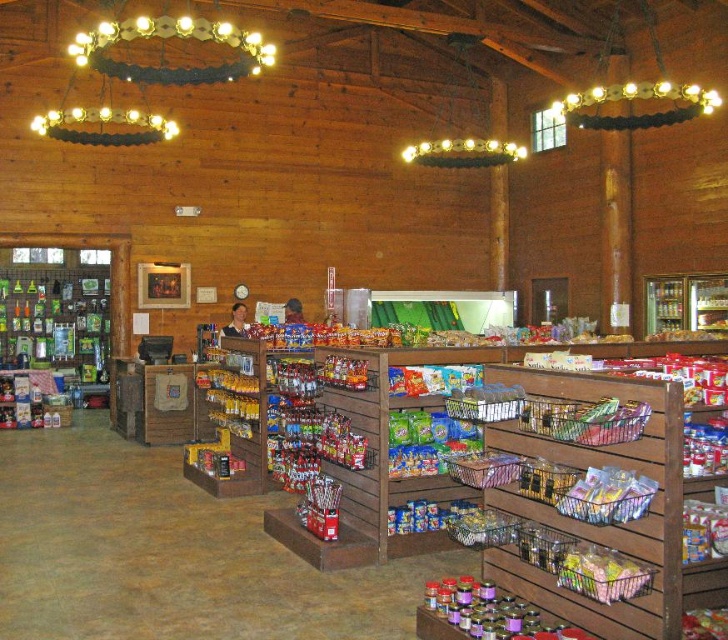
Question: Is gold metallic chandelier at upper center further to camera compared to shiny metallic can at lower right?

Choices:
 (A) no
 (B) yes

Answer: (B)

Question: Is gold metallic chandelier at upper center further to the viewer compared to metallic wire basket at center?

Choices:
 (A) no
 (B) yes

Answer: (B)

Question: Which point is farther to the camera?

Choices:
 (A) shiny metallic snack at right
 (B) shiny metallic can at lower right
 (C) metallic wire basket at center
 (D) shiny plastic candy at center

Answer: (D)

Question: Can you confirm if wooden shelves at center is positioned above shiny metallic can at lower right?

Choices:
 (A) yes
 (B) no

Answer: (A)

Question: Which object is the farthest from the metallic wire basket at center?

Choices:
 (A) wooden shelves at center
 (B) shiny metallic snack at right
 (C) shiny metallic can at lower right

Answer: (C)

Question: Which object appears closest to the camera in this image?

Choices:
 (A) wooden shelves at center
 (B) gold metallic chandelier at upper center

Answer: (A)